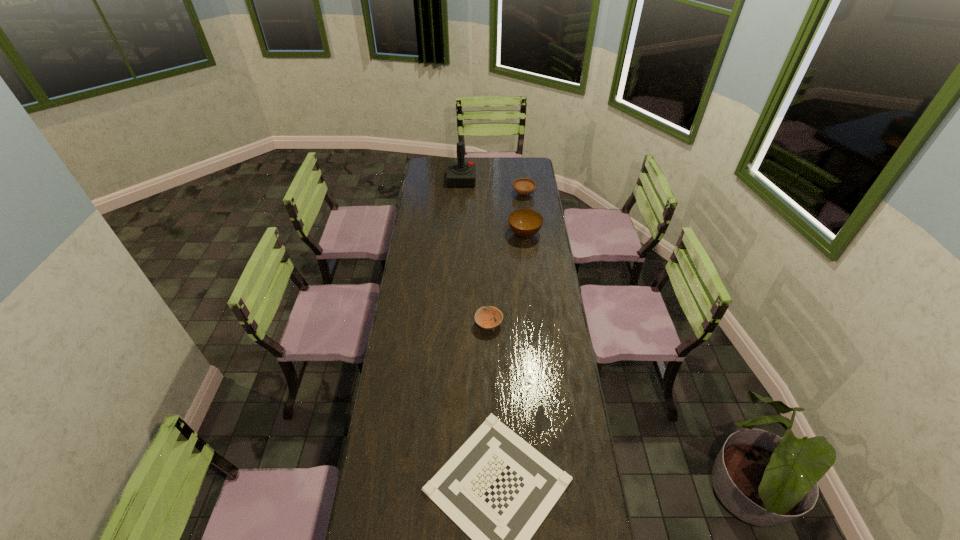
Where is `vacant point located 0.240m on the left of the leftmost bowl`? vacant point located 0.240m on the left of the leftmost bowl is located at coordinates (419, 325).

The height and width of the screenshot is (540, 960). I want to click on object that is at the far edge, so click(x=459, y=174).

This screenshot has height=540, width=960. I want to click on vacant space at the left edge, so click(x=396, y=359).

Find the location of a particular element. blank space at the right edge is located at coordinates (532, 261).

Where is `free location at the far left corner`? The height and width of the screenshot is (540, 960). free location at the far left corner is located at coordinates (432, 172).

The height and width of the screenshot is (540, 960). What are the coordinates of `vacant space at the far right corner of the desktop` in the screenshot? It's located at (518, 160).

This screenshot has height=540, width=960. Identify the location of empty space between the farthest bowl and the leftmost bowl. (506, 259).

Where is `free space between the third nearest object and the second shortest object`? free space between the third nearest object and the second shortest object is located at coordinates (507, 279).

Where is `empty space between the third shortest object and the tallest object`? This screenshot has height=540, width=960. empty space between the third shortest object and the tallest object is located at coordinates pos(492,187).

Where is `empty location between the third tallest object and the tallest object`? The image size is (960, 540). empty location between the third tallest object and the tallest object is located at coordinates pos(492,187).